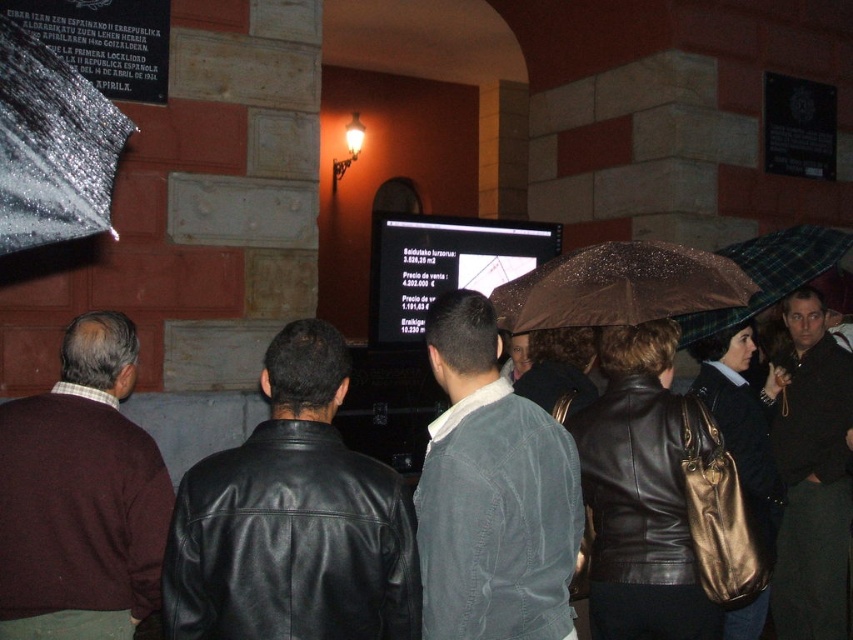
You are standing at the point marked by the coordinates (492, 493) in the image. What type of clothing item are you currently positioned on?

The point at (492, 493) is on the dark gray corduroy jacket at center.

In the scene, there is a dark gray corduroy jacket at center and a shiny metallic umbrella at upper left. From the perspective of someone standing at the front of the group facing the screen, which object is positioned to the right?

The dark gray corduroy jacket at center is positioned to the right of the shiny metallic umbrella at upper left.

You are standing at the point labeled as point (508,493) and want to walk towards the screen where the presentation is displayed. There is an obstacle at point (252,532). Will you be able to see the screen clearly once you reach your destination?

Since point (252,532) is in front of point (508,493), the obstacle at point (252,532) will block your view of the screen when you reach point (508,493).